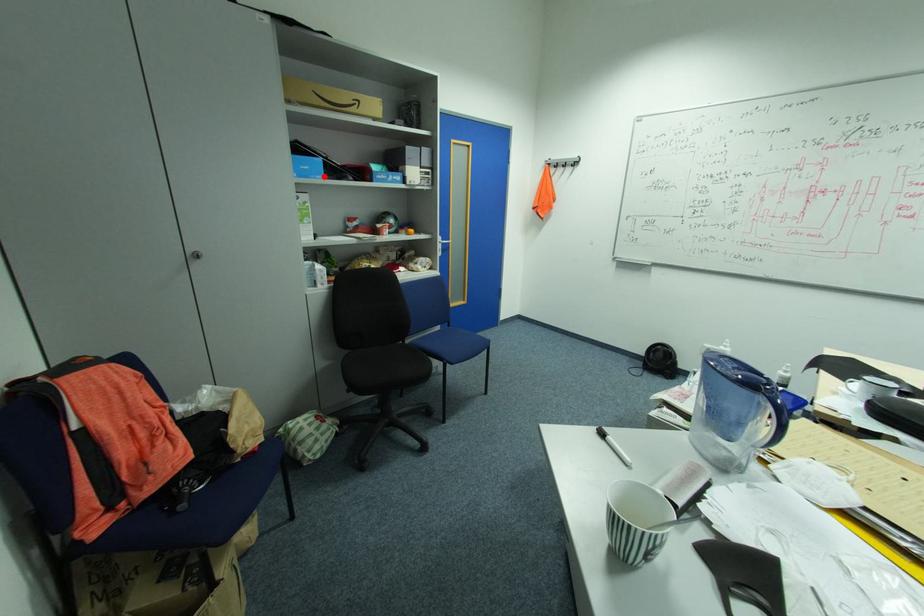
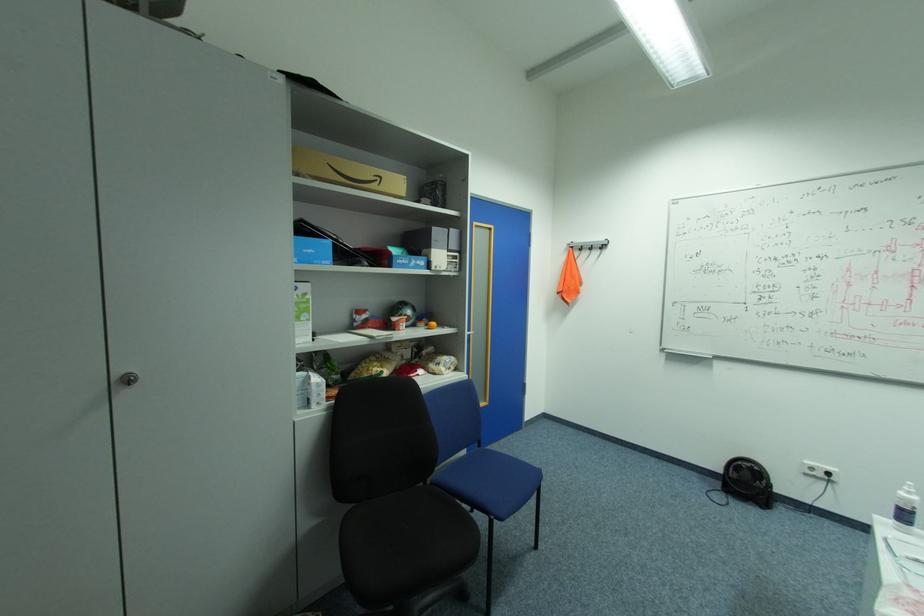
Question: I am providing you with two images of the same scene from different viewpoints. A red point is marked on the first image. Can you still see the location of the red point in image 2?

Choices:
 (A) Yes
 (B) No

Answer: (A)